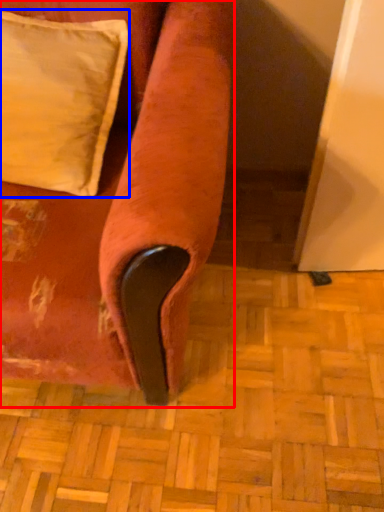
Question: Which point is closer to the camera, furniture (highlighted by a red box) or pillow (highlighted by a blue box)?

Choices:
 (A) furniture
 (B) pillow

Answer: (A)